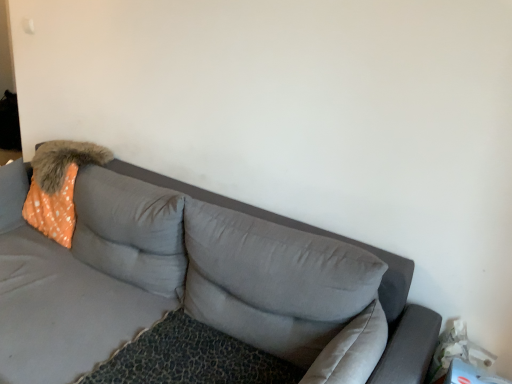
Question: Are orange dotted fabric pillow at upper left, which is counted as the second pillow, starting from the right, and gray fabric couch at center located far from each other?

Choices:
 (A) yes
 (B) no

Answer: (B)

Question: Considering the relative sizes of orange dotted fabric pillow at upper left, arranged as the first pillow when viewed from the left, and gray fabric couch at center in the image provided, is orange dotted fabric pillow at upper left, arranged as the first pillow when viewed from the left, taller than gray fabric couch at center?

Choices:
 (A) yes
 (B) no

Answer: (B)

Question: Does orange dotted fabric pillow at upper left, which is counted as the second pillow, starting from the right, appear on the left side of gray fabric couch at center?

Choices:
 (A) no
 (B) yes

Answer: (A)

Question: Is orange dotted fabric pillow at upper left, which is counted as the second pillow, starting from the right, shorter than gray fabric couch at center?

Choices:
 (A) yes
 (B) no

Answer: (A)

Question: Does orange dotted fabric pillow at upper left, which is counted as the second pillow, starting from the right, have a lesser width compared to gray fabric couch at center?

Choices:
 (A) yes
 (B) no

Answer: (A)

Question: From a real-world perspective, is orange dotted fabric pillow at upper left, arranged as the first pillow when viewed from the left, physically below gray fabric couch at center?

Choices:
 (A) no
 (B) yes

Answer: (A)

Question: Is gray fabric pillow at center, which is counted as the first pillow, starting from the right, positioned far away from orange dotted fabric pillow at upper left, arranged as the first pillow when viewed from the left?

Choices:
 (A) no
 (B) yes

Answer: (A)

Question: Is orange dotted fabric pillow at upper left, which is counted as the second pillow, starting from the right, surrounded by gray fabric pillow at center, which is counted as the first pillow, starting from the right?

Choices:
 (A) no
 (B) yes

Answer: (A)

Question: Can you confirm if gray fabric pillow at center, which is counted as the first pillow, starting from the right, is shorter than orange dotted fabric pillow at upper left, arranged as the first pillow when viewed from the left?

Choices:
 (A) yes
 (B) no

Answer: (A)

Question: Can you confirm if gray fabric pillow at center, which is counted as the first pillow, starting from the right, is smaller than orange dotted fabric pillow at upper left, arranged as the first pillow when viewed from the left?

Choices:
 (A) yes
 (B) no

Answer: (B)

Question: From a real-world perspective, is gray fabric pillow at center, which is counted as the first pillow, starting from the right, on orange dotted fabric pillow at upper left, which is counted as the second pillow, starting from the right?

Choices:
 (A) no
 (B) yes

Answer: (B)

Question: Is gray fabric pillow at center, which is counted as the 2th pillow, starting from the left, turned away from orange dotted fabric pillow at upper left, which is counted as the second pillow, starting from the right?

Choices:
 (A) yes
 (B) no

Answer: (B)

Question: Is orange dotted fabric at left closer to camera compared to orange dotted fabric pillow at upper left, which is counted as the second pillow, starting from the right?

Choices:
 (A) no
 (B) yes

Answer: (A)